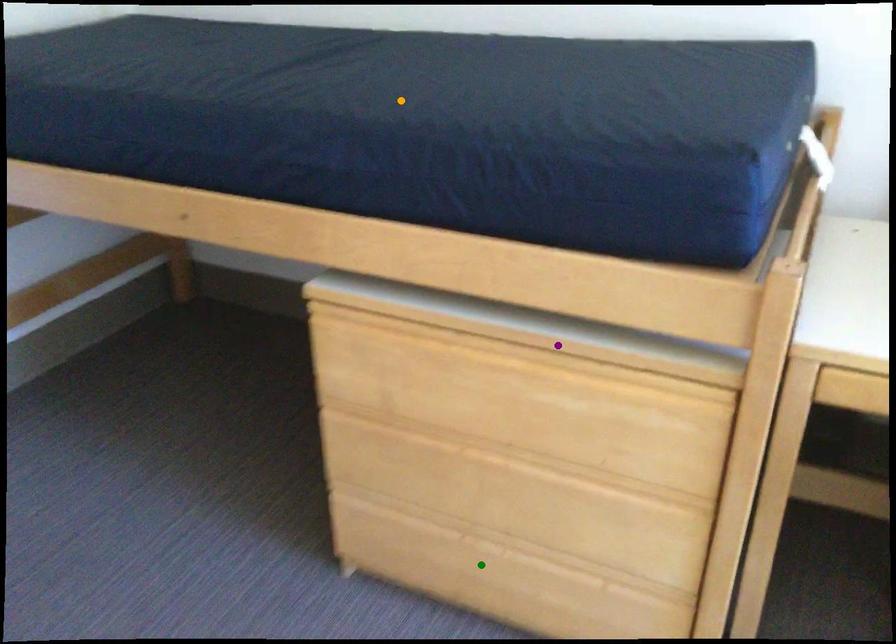
Order these from farthest to nearest:
1. orange point
2. purple point
3. green point

green point → orange point → purple point